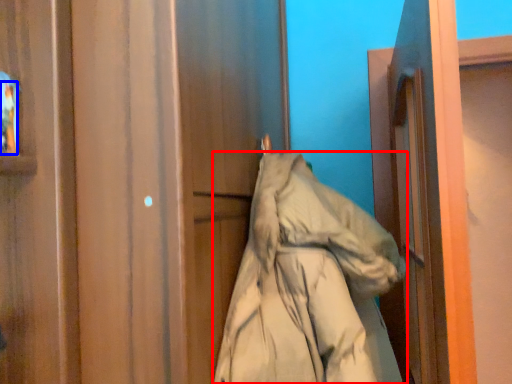
Question: Which object appears closest to the camera in this image, coat (highlighted by a red box) or person (highlighted by a blue box)?

Choices:
 (A) coat
 (B) person

Answer: (A)